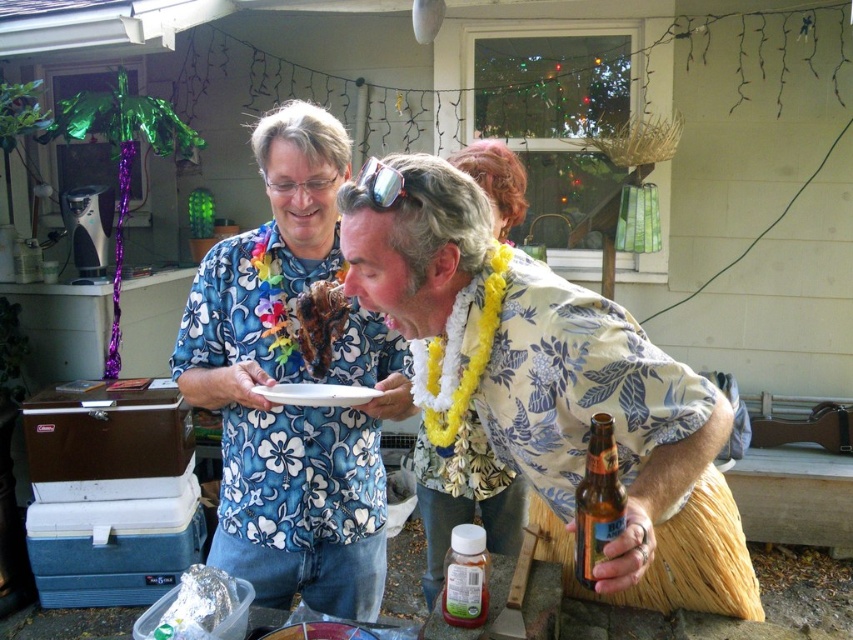
Question: Is brown glass bottle at lower right closer to the viewer compared to translucent plastic bottle at lower center?

Choices:
 (A) yes
 (B) no

Answer: (A)

Question: Does translucent plastic bottle at lower center appear on the left side of brown crispy meat at center?

Choices:
 (A) yes
 (B) no

Answer: (B)

Question: Which of these objects is positioned closest to the translucent plastic bottle at lower center?

Choices:
 (A) white fabric lei at center
 (B) brown glass bottle at lower right
 (C) brown crispy meat at center

Answer: (B)

Question: Which is farther from the floral fabric shirt at center?

Choices:
 (A) brown crispy meat at center
 (B) white fabric lei at center

Answer: (A)

Question: Which point appears farthest from the camera in this image?

Choices:
 (A) (341, 596)
 (B) (339, 316)
 (C) (459, 593)

Answer: (A)

Question: Is floral fabric shirt at center positioned in front of translucent plastic bottle at lower center?

Choices:
 (A) no
 (B) yes

Answer: (B)